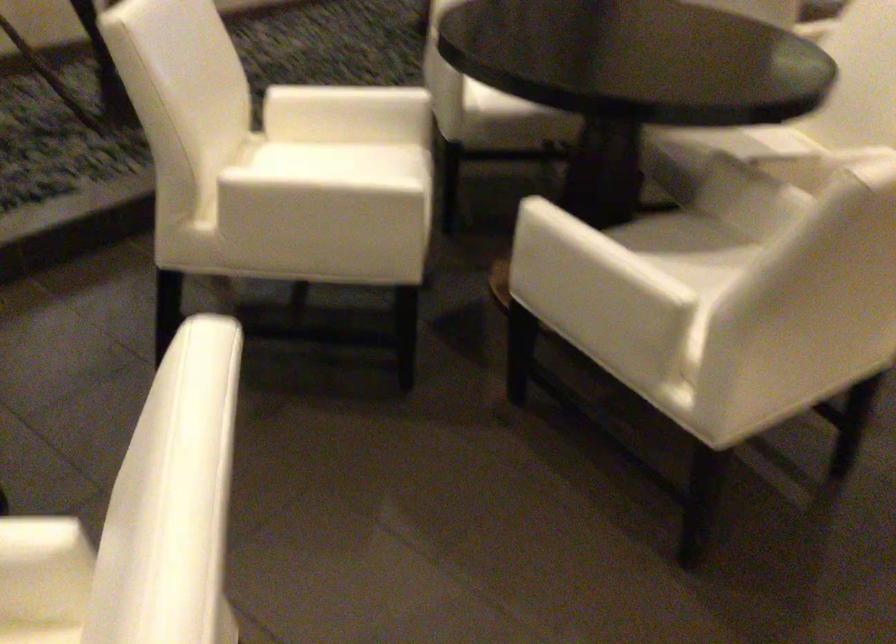
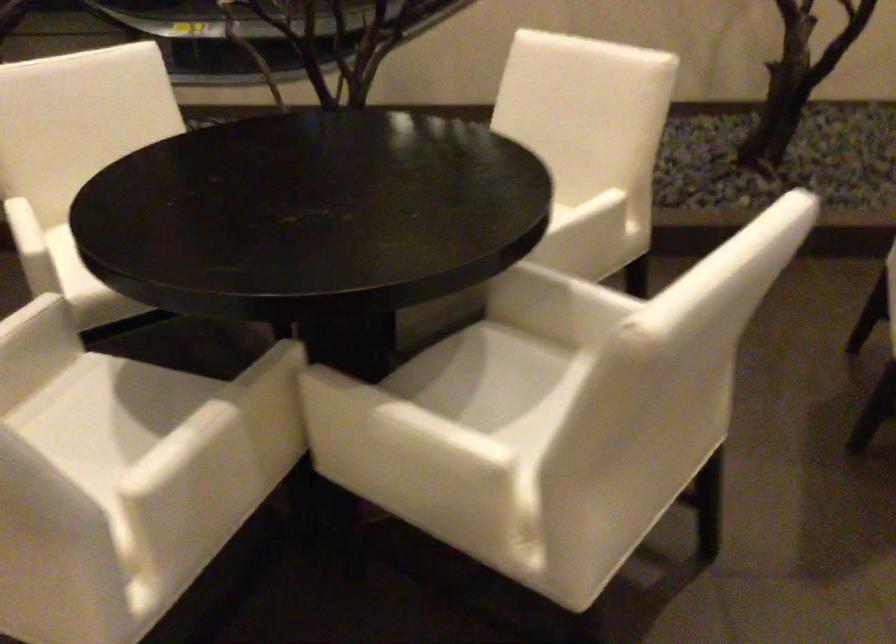
Find the pixel in the second image that matches pixel 698 243 in the first image.

(156, 420)